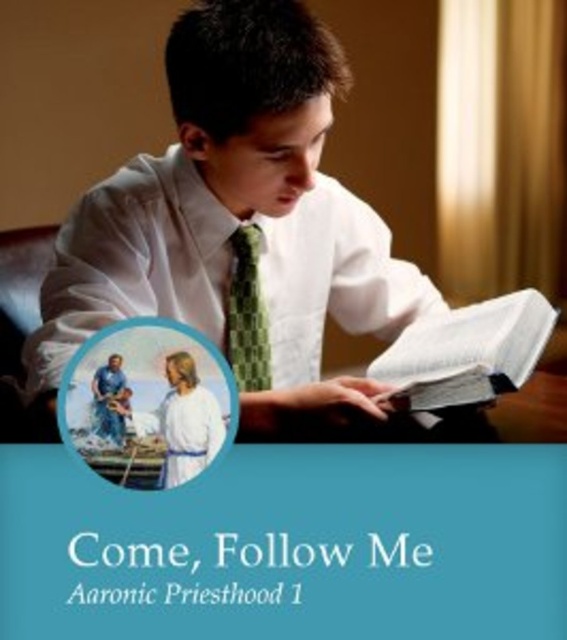
In the image, there is a blue paper at bottom and a green checkered tie at center. Which object is wider?

The blue paper at bottom is wider than the green checkered tie at center.

You are an interior designer assessing the layout of this room. The blue paper at bottom and the green checkered tie at center are both part of the decor. Which object is closer to the viewer?

The blue paper at bottom is closer to the viewer because it is positioned in front of the green checkered tie at center.

You are an interior designer asked to place a decorative item between the blue paper at bottom and the white smooth shirt at center. Where would you position it to ensure it is between them?

The decorative item should be placed between the blue paper at bottom and the white smooth shirt at center, so it should be positioned above the blue paper at bottom and below the white smooth shirt at center.